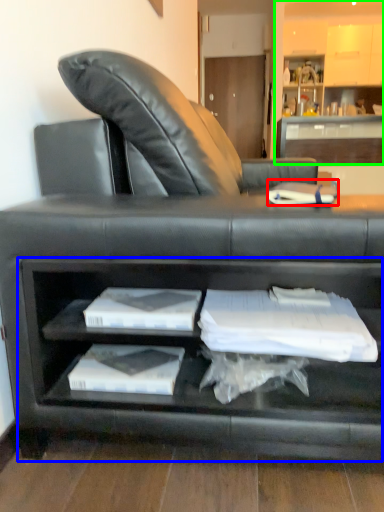
Question: Which is nearer to the book (highlighted by a red box)? cabinet (highlighted by a blue box) or entertainment center (highlighted by a green box).

Choices:
 (A) cabinet
 (B) entertainment center

Answer: (A)